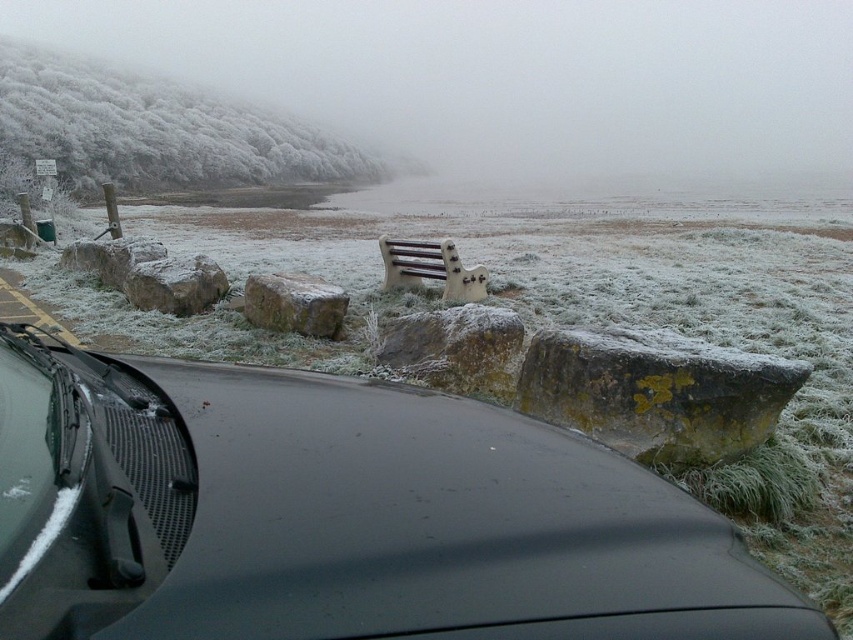
You are sitting in the car and want to see the white painted wood bench at center through the clear glass windshield at lower left. Can you see the entire bench through the windshield?

The clear glass windshield at lower left is not as tall as the white painted wood bench at center, so you cannot see the entire bench through the windshield because the windshield is shorter in height than the bench.

You are inside a car and want to check the visibility through the clear glass windshield at lower left. Based on the scene description, is the windshield obstructed by any objects in the immediate vicinity?

The clear glass windshield at lower left is positioned at point (x=84, y=486), which is within the car, so it is not obstructed by any objects in the immediate vicinity as described in the scene.

You are a photographer trying to capture the frosty landscape from inside the car. You notice the sandy brown rock at center and the white painted wood bench at center. Which object would appear wider in your photo?

The white painted wood bench at center appears wider in the photo because it has a greater width than the sandy brown rock at center.